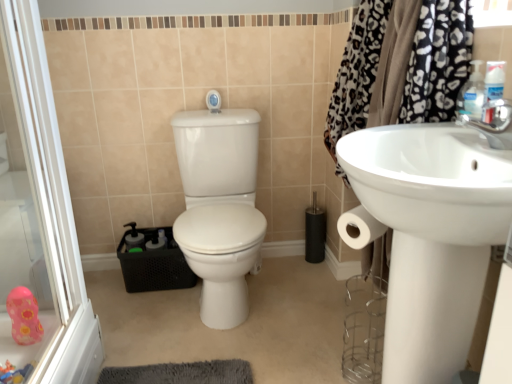
This screenshot has width=512, height=384. Identify the location of free location to the right of white glossy toilet at center. (310, 305).